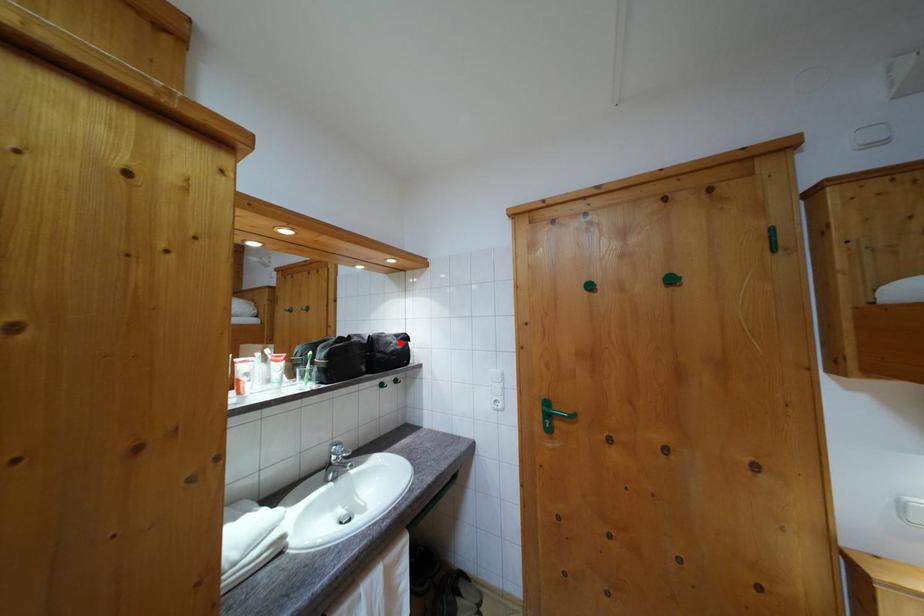
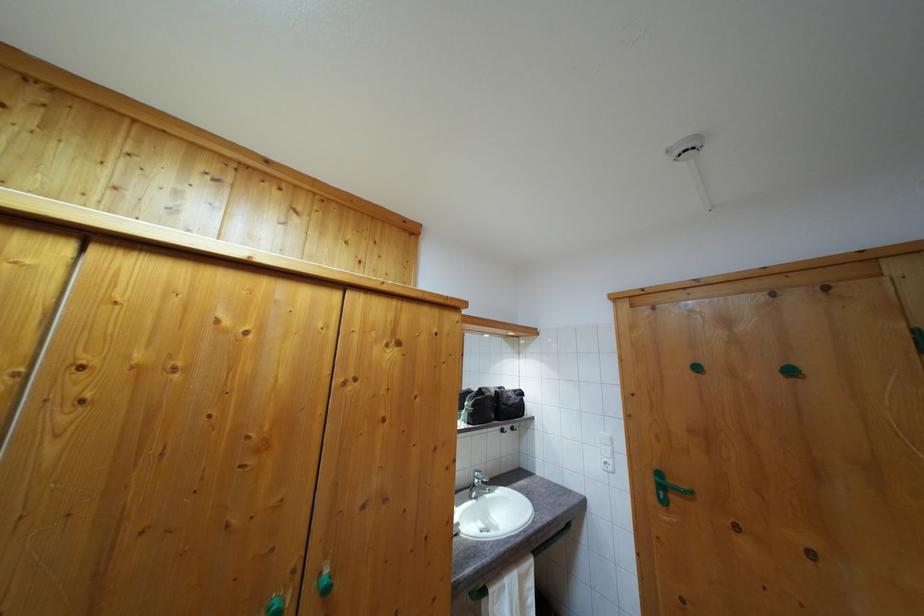
Find the pixel in the second image that matches the highlighted location in the first image.

(518, 398)